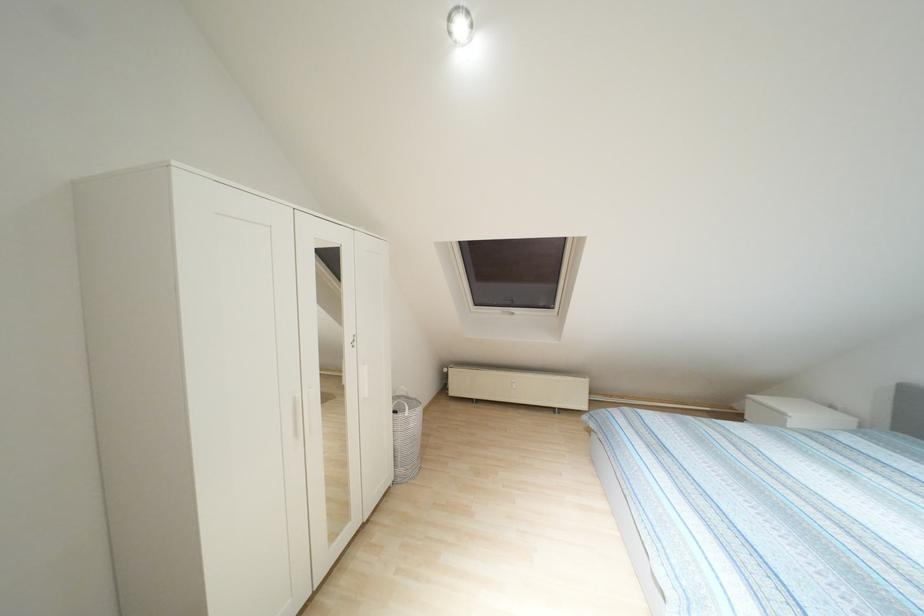
Identify the location of skylight window handle. The height and width of the screenshot is (616, 924). (506, 312).